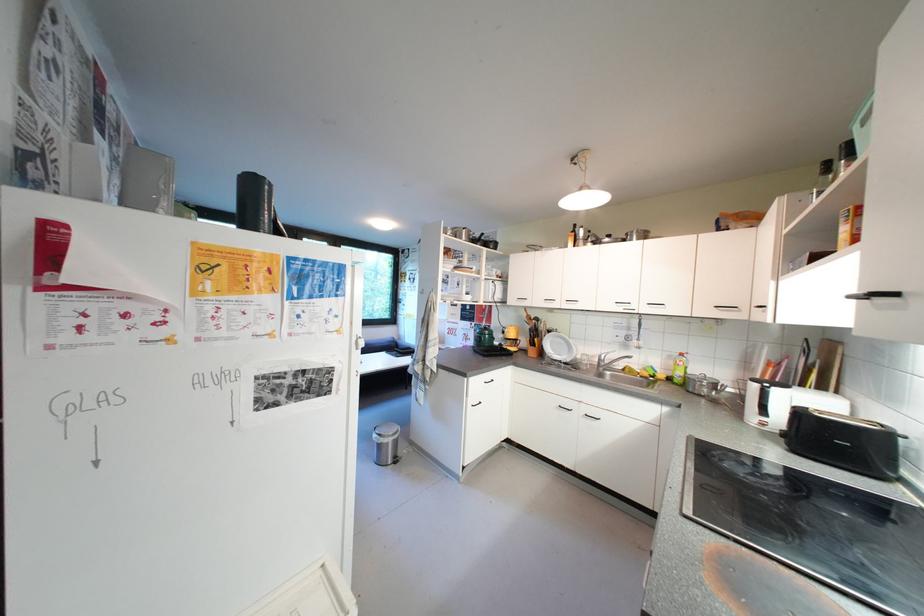
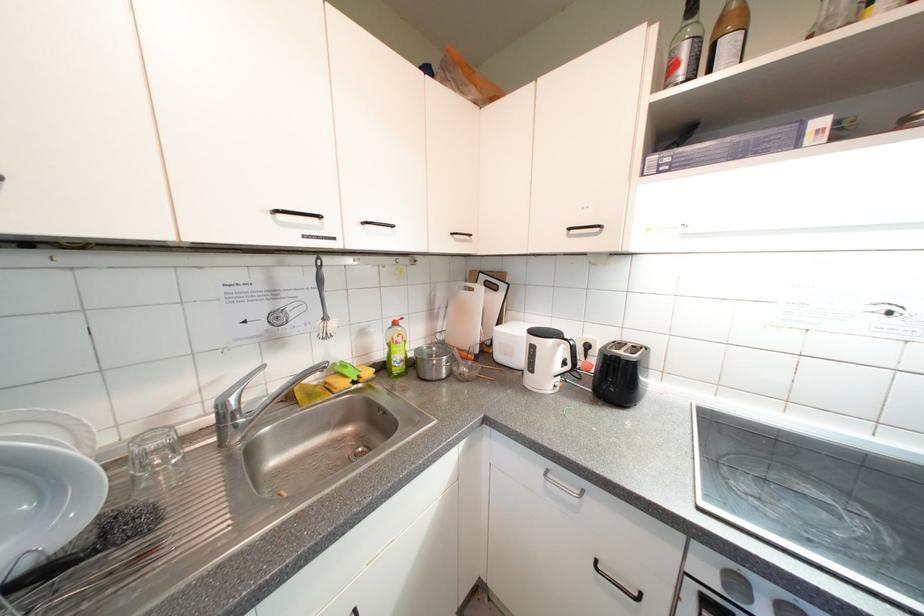
Where in the second image is the point corresponding to point (647, 342) from the first image?

(333, 321)